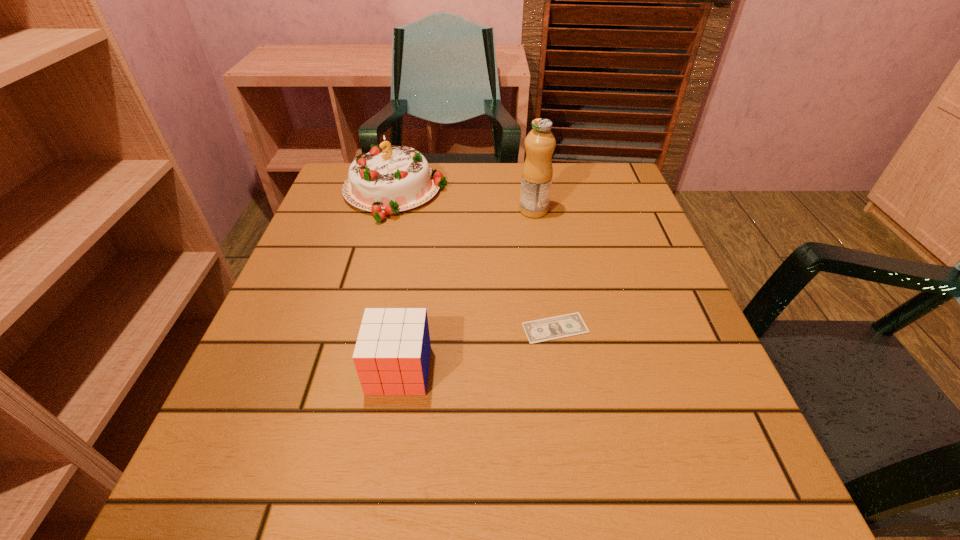
Locate an element on the screen. free location located on the right of the second shortest object is located at coordinates (600, 370).

Find the location of `vacant area situated 0.070m on the front of the second nearest object`. vacant area situated 0.070m on the front of the second nearest object is located at coordinates (564, 379).

You are a GUI agent. You are given a task and a screenshot of the screen. Output one action in this format:
    pyautogui.click(x=<x>, y=<y>)
    Task: Click on the fruit juice at the far edge
    
    Given the screenshot: What is the action you would take?
    pyautogui.click(x=537, y=171)

Identify the location of cake that is at the far edge. The image size is (960, 540). (386, 180).

This screenshot has width=960, height=540. I want to click on object that is positioned at the left edge, so click(x=386, y=180).

The image size is (960, 540). I want to click on object that is at the far left corner, so click(386, 180).

At what (x,y) coordinates should I click in order to perform the action: click on free space at the far edge. Please return your answer as a coordinate pair (x, y). Looking at the image, I should click on (500, 166).

This screenshot has width=960, height=540. I want to click on vacant space at the near edge, so click(x=632, y=512).

Locate an element on the screen. Image resolution: width=960 pixels, height=540 pixels. vacant space at the left edge is located at coordinates (321, 278).

At what (x,y) coordinates should I click in order to perform the action: click on free spot at the right edge of the desktop. Please return your answer as a coordinate pair (x, y). Looking at the image, I should click on (626, 220).